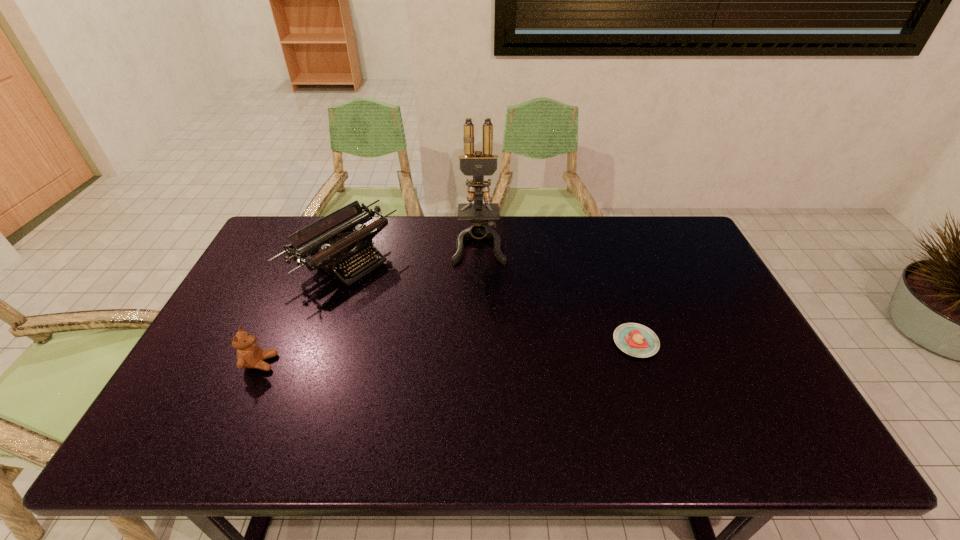
The image size is (960, 540). Identify the location of free space on the desktop that is between the second shortest object and the pastry and is positioned at the eyepieces of the tallest object. pos(481,350).

I want to click on vacant space on the desktop that is between the second shortest object and the rightmost object and is positioned on the typing side of the typewriter, so click(483, 350).